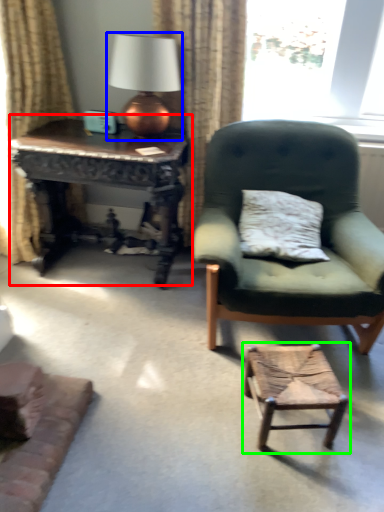
Question: Which is nearer to the nightstand (highlighted by a red box)? table lamp (highlighted by a blue box) or stool (highlighted by a green box).

Choices:
 (A) table lamp
 (B) stool

Answer: (A)